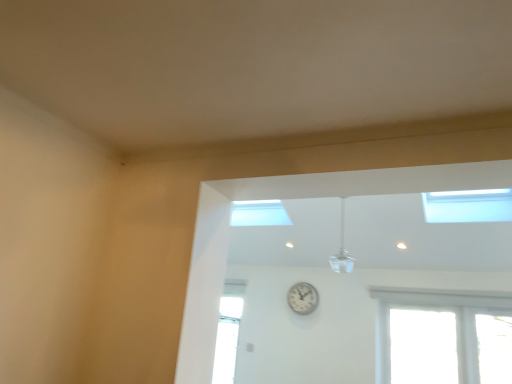
Question: Is white metallic clock at center bigger or smaller than transparent glass window at upper right?

Choices:
 (A) small
 (B) big

Answer: (A)

Question: Looking at their shapes, would you say white metallic clock at center is wider or thinner than transparent glass window at upper right?

Choices:
 (A) wide
 (B) thin

Answer: (B)

Question: Which is nearer to the white glossy ceiling fan at upper center?

Choices:
 (A) white metallic clock at center
 (B) transparent glass window at upper right

Answer: (A)

Question: Based on their relative distances, which object is farther from the transparent glass window at upper right?

Choices:
 (A) white glossy ceiling fan at upper center
 (B) white metallic clock at center

Answer: (B)